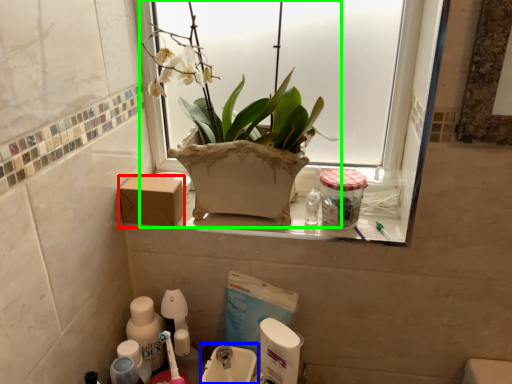
Question: Which object is the closest to the cardboard box (highlighted by a red box)? Choose among these: sink (highlighted by a blue box) or houseplant (highlighted by a green box).

Choices:
 (A) sink
 (B) houseplant

Answer: (B)